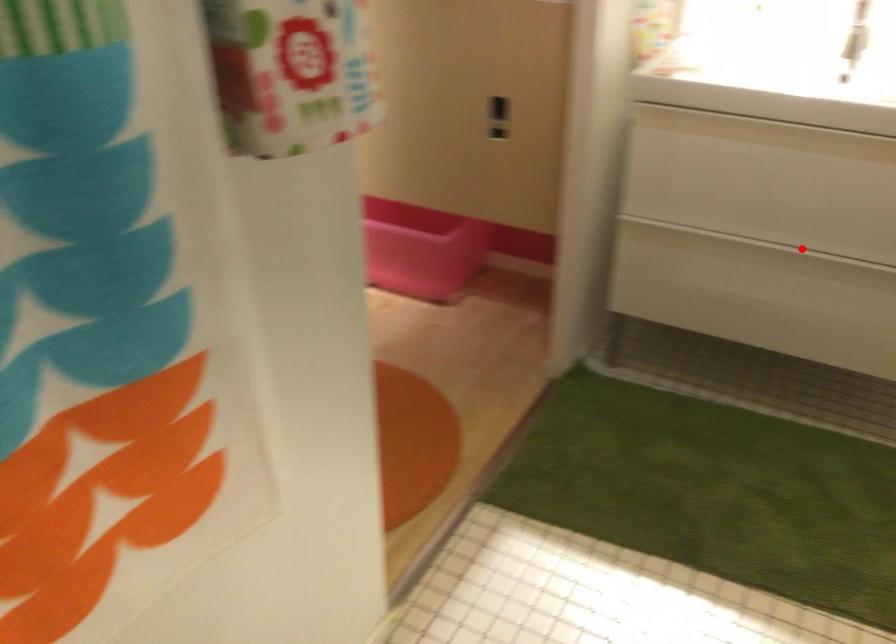
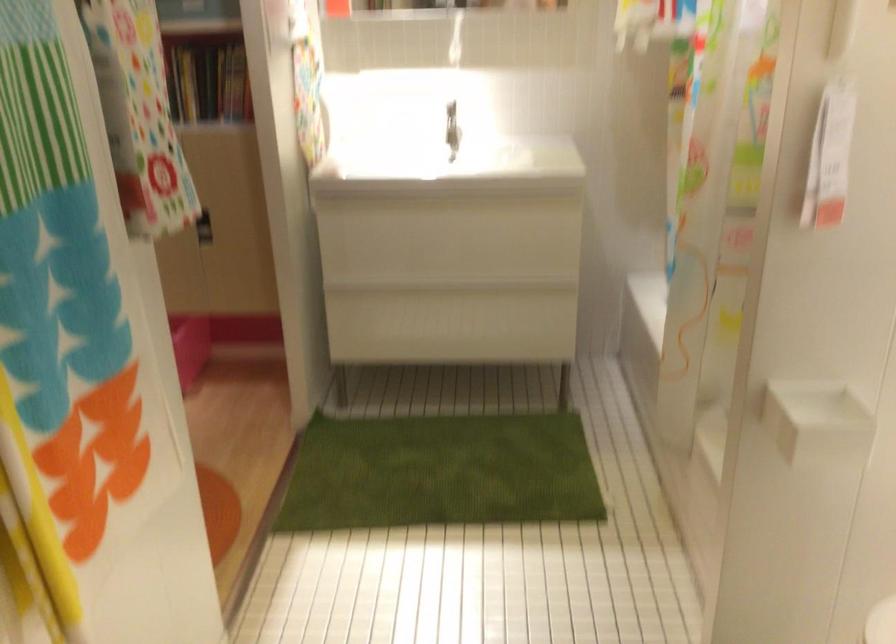
Question: I am providing you with two images of the same scene from different viewpoints. In image1, a red point is highlighted. Considering the same 3D point in image2, which of the following is correct?

Choices:
 (A) It is closer
 (B) It is farther

Answer: (B)